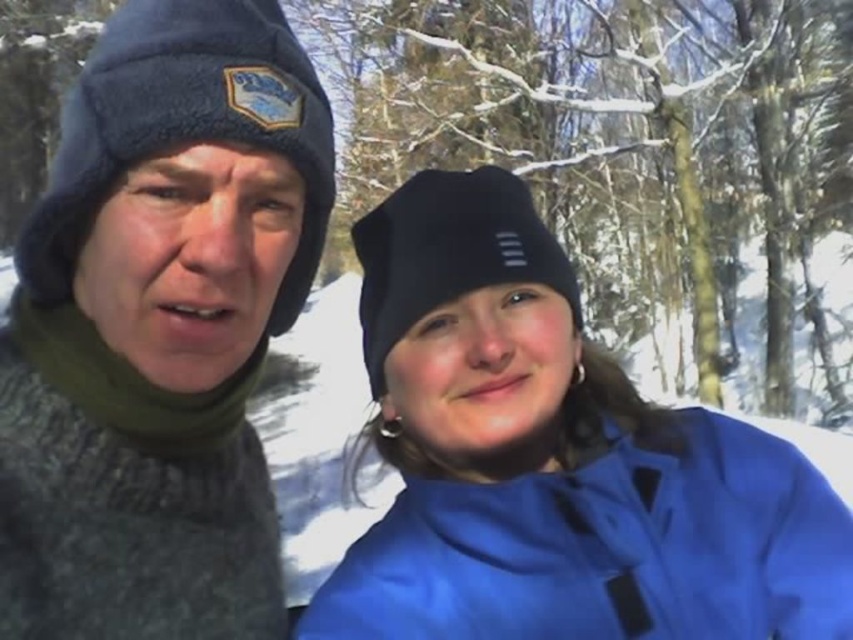
Is knitted wool sweater at left below blue matte jacket at center?

No.

Can you confirm if knitted wool sweater at left is smaller than blue matte jacket at center?

Yes.

Is point (54, 538) positioned after point (689, 589)?

No, it is in front of (689, 589).

Locate an element on the screen. knitted wool sweater at left is located at coordinates (160, 328).